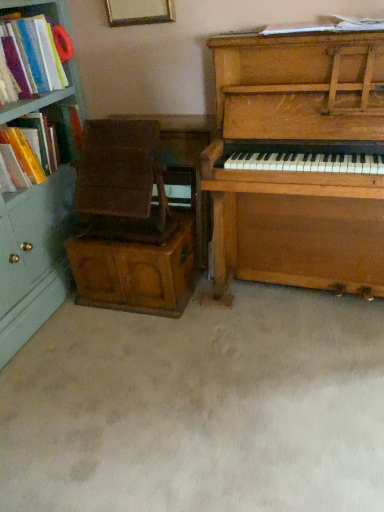
Question: From the image's perspective, is matte plastic book at left, the second book viewed from the left, under white paper at upper center, positioned as the 3th book in left-to-right order?

Choices:
 (A) yes
 (B) no

Answer: (A)

Question: Considering the relative sizes of matte plastic book at left, the second book viewed from the left, and white paper at upper center, positioned as the 3th book in left-to-right order, in the image provided, is matte plastic book at left, the second book viewed from the left, wider than white paper at upper center, positioned as the 3th book in left-to-right order,?

Choices:
 (A) yes
 (B) no

Answer: (A)

Question: Can you confirm if matte plastic book at left, the second book viewed from the left, is taller than white paper at upper center, positioned as the 3th book in left-to-right order?

Choices:
 (A) no
 (B) yes

Answer: (B)

Question: Is matte plastic book at left, the second book viewed from the left, shorter than white paper at upper center, marked as the 1th book in a right-to-left arrangement?

Choices:
 (A) yes
 (B) no

Answer: (B)

Question: Is matte plastic book at left, the second book when ordered from right to left, oriented away from white paper at upper center, marked as the 1th book in a right-to-left arrangement?

Choices:
 (A) yes
 (B) no

Answer: (B)

Question: From a real-world perspective, relative to wooden armchair at left, which is counted as the 2th armchair, starting from the bottom, is white paper at upper center, positioned as the 3th book in left-to-right order, vertically above or below?

Choices:
 (A) above
 (B) below

Answer: (A)

Question: From the image's perspective, is white paper at upper center, positioned as the 3th book in left-to-right order, above or below wooden armchair at left, which is counted as the 2th armchair, starting from the bottom?

Choices:
 (A) above
 (B) below

Answer: (A)

Question: Which is correct: white paper at upper center, positioned as the 3th book in left-to-right order, is inside wooden armchair at left, acting as the first armchair starting from the top, or outside of it?

Choices:
 (A) outside
 (B) inside

Answer: (A)

Question: Relative to wooden armchair at left, acting as the first armchair starting from the top, is white paper at upper center, positioned as the 3th book in left-to-right order, in front or behind?

Choices:
 (A) behind
 (B) front

Answer: (B)

Question: From a real-world perspective, is wooden armchair at left, acting as the first armchair starting from the top, positioned above or below white paper at upper center, marked as the 1th book in a right-to-left arrangement?

Choices:
 (A) below
 (B) above

Answer: (A)

Question: Is wooden armchair at left, acting as the first armchair starting from the top, taller or shorter than white paper at upper center, marked as the 1th book in a right-to-left arrangement?

Choices:
 (A) tall
 (B) short

Answer: (A)

Question: In terms of width, does wooden armchair at left, acting as the first armchair starting from the top, look wider or thinner when compared to white paper at upper center, positioned as the 3th book in left-to-right order?

Choices:
 (A) wide
 (B) thin

Answer: (B)

Question: Is wooden armchair at left, acting as the first armchair starting from the top, to the left or to the right of white paper at upper center, positioned as the 3th book in left-to-right order, in the image?

Choices:
 (A) right
 (B) left

Answer: (B)

Question: Would you say wooden piano at right is inside or outside matte plastic books at left, the first book in the left-to-right sequence?

Choices:
 (A) inside
 (B) outside

Answer: (B)

Question: In terms of width, does wooden piano at right look wider or thinner when compared to matte plastic books at left, marked as the third book in a right-to-left arrangement?

Choices:
 (A) thin
 (B) wide

Answer: (B)